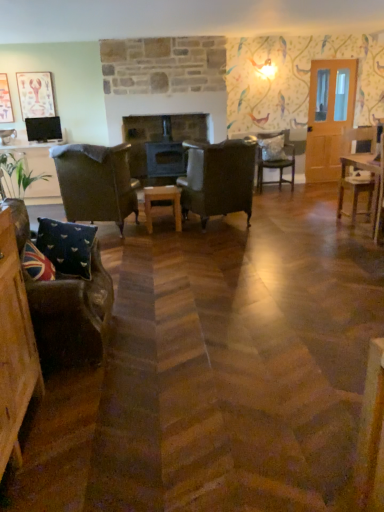
What do you see at coordinates (218, 179) in the screenshot? I see `leather armchair at center, which ranks as the fourth chair in back-to-front order` at bounding box center [218, 179].

Where is `brown leather armchair at left, which appears as the fifth chair when viewed from the right`? This screenshot has width=384, height=512. brown leather armchair at left, which appears as the fifth chair when viewed from the right is located at coordinates (96, 183).

What is the approximate height of white fabric pillow at center, arranged as the 1th pillow when viewed from the back?

The height of white fabric pillow at center, arranged as the 1th pillow when viewed from the back, is 16.36 inches.

The image size is (384, 512). What do you see at coordinates (272, 147) in the screenshot?
I see `white fabric pillow at center, arranged as the 3th pillow when viewed from the left` at bounding box center [272, 147].

The width and height of the screenshot is (384, 512). Describe the element at coordinates (356, 169) in the screenshot. I see `wooden chair at right, which is the second chair from back to front` at that location.

What do you see at coordinates (35, 94) in the screenshot?
I see `matte pink picture frame at upper left, which is counted as the 1th picture frame, starting from the right` at bounding box center [35, 94].

What are the coordinates of `leather armchair at center, which is counted as the 2th chair, starting from the front` in the screenshot? It's located at (218, 179).

Which of these two, white fabric pillow at center, which is counted as the third pillow, starting from the bottom, or wooden picture frame at upper left, which is the first picture frame from left to right, stands taller?

wooden picture frame at upper left, which is the first picture frame from left to right.

From a real-world perspective, is white fabric pillow at center, acting as the third pillow starting from the front, above or below wooden picture frame at upper left, which is the first picture frame from left to right?

In terms of real-world spatial position, white fabric pillow at center, acting as the third pillow starting from the front, is below wooden picture frame at upper left, which is the first picture frame from left to right.

In terms of width, does white fabric pillow at center, acting as the third pillow starting from the front, look wider or thinner when compared to wooden picture frame at upper left, which is the first picture frame from left to right?

Considering their sizes, white fabric pillow at center, acting as the third pillow starting from the front, looks broader than wooden picture frame at upper left, which is the first picture frame from left to right.

From the image's perspective, is union jack fabric pillow at lower left, acting as the first pillow starting from the bottom, above or below leather armchair at center, marked as the 3th chair in a right-to-left arrangement?

union jack fabric pillow at lower left, acting as the first pillow starting from the bottom, is below leather armchair at center, marked as the 3th chair in a right-to-left arrangement.

Measure the distance from union jack fabric pillow at lower left, acting as the first pillow starting from the bottom, to leather armchair at center, marked as the 3th chair in a right-to-left arrangement.

union jack fabric pillow at lower left, acting as the first pillow starting from the bottom, and leather armchair at center, marked as the 3th chair in a right-to-left arrangement, are 8.87 feet apart from each other.

Is union jack fabric pillow at lower left, the third pillow viewed from the right, aimed at leather armchair at center, which is counted as the 2th chair, starting from the front?

No, union jack fabric pillow at lower left, the third pillow viewed from the right, does not turn towards leather armchair at center, which is counted as the 2th chair, starting from the front.

Considering the relative positions of union jack fabric pillow at lower left, the first pillow in the front-to-back sequence, and leather armchair at center, which ranks as the fourth chair in back-to-front order, in the image provided, is union jack fabric pillow at lower left, the first pillow in the front-to-back sequence, to the left of leather armchair at center, which ranks as the fourth chair in back-to-front order, from the viewer's perspective?

Indeed, union jack fabric pillow at lower left, the first pillow in the front-to-back sequence, is positioned on the left side of leather armchair at center, which ranks as the fourth chair in back-to-front order.

Can you confirm if wooden picture frame at upper left, which is the first picture frame from left to right, is shorter than wooden table at center?

No.

Can you confirm if wooden picture frame at upper left, which is the first picture frame from left to right, is thinner than wooden table at center?

Indeed, wooden picture frame at upper left, which is the first picture frame from left to right, has a lesser width compared to wooden table at center.

Is wooden picture frame at upper left, which is the first picture frame from left to right, far away from wooden table at center?

Yes.

From the image's perspective, between wooden picture frame at upper left, which is the first picture frame from left to right, and wooden table at center, which one is located above?

wooden picture frame at upper left, which is the first picture frame from left to right.

Does wooden chair at right, which is the second chair from back to front, contain leather armchair at center, marked as the 3th chair in a right-to-left arrangement?

No, leather armchair at center, marked as the 3th chair in a right-to-left arrangement, is not surrounded by wooden chair at right, which is the second chair from back to front.

Looking at their sizes, would you say wooden chair at right, the 4th chair viewed from the front, is wider or thinner than leather armchair at center, which ranks as the fourth chair in back-to-front order?

Considering their sizes, wooden chair at right, the 4th chair viewed from the front, looks slimmer than leather armchair at center, which ranks as the fourth chair in back-to-front order.

Based on their positions, is wooden chair at right, the 4th chair viewed from the front, located to the left or right of leather armchair at center, marked as the 3th chair in a right-to-left arrangement?

Based on their positions, wooden chair at right, the 4th chair viewed from the front, is located to the right of leather armchair at center, marked as the 3th chair in a right-to-left arrangement.

Can you confirm if wooden chair at right, placed as the 5th chair when sorted from left to right, is positioned to the right of velvet union jack pillow at lower left, marked as the 2th pillow in a bottom-to-top arrangement?

Indeed, wooden chair at right, placed as the 5th chair when sorted from left to right, is positioned on the right side of velvet union jack pillow at lower left, marked as the 2th pillow in a bottom-to-top arrangement.

How far apart are wooden chair at right, the 4th chair viewed from the front, and velvet union jack pillow at lower left, which appears as the 2th pillow when viewed from the right?

wooden chair at right, the 4th chair viewed from the front, and velvet union jack pillow at lower left, which appears as the 2th pillow when viewed from the right, are 3.57 meters apart.

Between wooden chair at right, which is the 1th chair from right to left, and velvet union jack pillow at lower left, marked as the 2th pillow in a bottom-to-top arrangement, which one has larger size?

Bigger between the two is wooden chair at right, which is the 1th chair from right to left.

From the picture: Is the surface of wooden chair at right, which is the second chair from back to front, in direct contact with velvet union jack pillow at lower left, which is the second pillow in top-to-bottom order?

wooden chair at right, which is the second chair from back to front, is not next to velvet union jack pillow at lower left, which is the second pillow in top-to-bottom order, and they're not touching.

Considering the relative sizes of velvet union jack pillow at lower left, marked as the second pillow in a left-to-right arrangement, and velvet dark brown armchair at lower left, which is counted as the 5th chair, starting from the back, in the image provided, is velvet union jack pillow at lower left, marked as the second pillow in a left-to-right arrangement, shorter than velvet dark brown armchair at lower left, which is counted as the 5th chair, starting from the back,?

Yes.

Which object is more forward, velvet union jack pillow at lower left, the 2th pillow viewed from the front, or velvet dark brown armchair at lower left, the fourth chair positioned from the right?

Positioned in front is velvet dark brown armchair at lower left, the fourth chair positioned from the right.

From a real-world perspective, is velvet union jack pillow at lower left, marked as the 2th pillow in a bottom-to-top arrangement, positioned above or below velvet dark brown armchair at lower left, positioned as the first chair in front-to-back order?

In terms of real-world spatial position, velvet union jack pillow at lower left, marked as the 2th pillow in a bottom-to-top arrangement, is above velvet dark brown armchair at lower left, positioned as the first chair in front-to-back order.

Is velvet union jack pillow at lower left, the 2th pillow viewed from the front, wider than velvet dark brown armchair at lower left, the fourth chair positioned from the right?

No, velvet union jack pillow at lower left, the 2th pillow viewed from the front, is not wider than velvet dark brown armchair at lower left, the fourth chair positioned from the right.

Are black wood stove at center and white fabric pillow at center, arranged as the 3th pillow when viewed from the left, making contact?

black wood stove at center and white fabric pillow at center, arranged as the 3th pillow when viewed from the left, are clearly separated.

What's the angular difference between black wood stove at center and white fabric pillow at center, which is counted as the third pillow, starting from the bottom,'s facing directions?

0.00127 degrees separate the facing orientations of black wood stove at center and white fabric pillow at center, which is counted as the third pillow, starting from the bottom.

Looking at this image, from the image's perspective, which is below, black wood stove at center or white fabric pillow at center, acting as the third pillow starting from the front?

→ black wood stove at center is shown below in the image.

From the wooden picture frame at upper left, which is the first picture frame from left to right, count 3rd pillow to the right and point to it. Please provide its 2D coordinates.

[(272, 147)]

Which chair is the 1st one when counting from the back of the union jack fabric pillow at lower left, acting as the third pillow starting from the top? Please provide its 2D coordinates.

[(218, 179)]

From the image, which object appears to be nearer to brown leather armchair at left, which appears as the fifth chair when viewed from the right, wooden picture frame at upper left, the second picture frame from the right, or white fabric pillow at center, acting as the third pillow starting from the front?

Among the two, wooden picture frame at upper left, the second picture frame from the right, is located nearer to brown leather armchair at left, which appears as the fifth chair when viewed from the right.

Based on their spatial positions, is white fabric pillow at center, arranged as the first pillow when viewed from the top, or velvet union jack pillow at lower left, which appears as the 2th pillow when viewed from the right, closer to matte pink picture frame at upper left, which is counted as the 1th picture frame, starting from the right?

Based on the image, white fabric pillow at center, arranged as the first pillow when viewed from the top, appears to be nearer to matte pink picture frame at upper left, which is counted as the 1th picture frame, starting from the right.

Looking at the image, which one is located further to wooden chair at right, which is the second chair from back to front, velvet cushioned chair at center, which is the 1th chair in back-to-front order, or wooden table at center?

wooden table at center is further to wooden chair at right, which is the second chair from back to front.

Considering their positions, is union jack fabric pillow at lower left, marked as the 3th pillow in a back-to-front arrangement, positioned closer to wooden table at center than wooden chair at right, the 4th chair viewed from the front?

Based on the image, wooden chair at right, the 4th chair viewed from the front, appears to be nearer to wooden table at center.

From the picture: Based on their spatial positions, is matte pink picture frame at upper left, which is counted as the 1th picture frame, starting from the right, or wooden picture frame at upper left, the second picture frame from the right, closer to velvet union jack pillow at lower left, marked as the 2th pillow in a bottom-to-top arrangement?

Among the two, matte pink picture frame at upper left, which is counted as the 1th picture frame, starting from the right, is located nearer to velvet union jack pillow at lower left, marked as the 2th pillow in a bottom-to-top arrangement.

Based on their spatial positions, is black wood stove at center or wooden chair at right, the 4th chair viewed from the front, closer to wooden picture frame at upper left, which is the first picture frame from left to right?

black wood stove at center is closer to wooden picture frame at upper left, which is the first picture frame from left to right.

Considering their positions, is matte pink picture frame at upper left, which is counted as the 1th picture frame, starting from the right, positioned closer to velvet union jack pillow at lower left, which is the second pillow in top-to-bottom order, than brown leather armchair at left, arranged as the 3th chair when viewed from the back?

The object closer to velvet union jack pillow at lower left, which is the second pillow in top-to-bottom order, is brown leather armchair at left, arranged as the 3th chair when viewed from the back.

Based on their spatial positions, is white fabric pillow at center, which is counted as the third pillow, starting from the bottom, or union jack fabric pillow at lower left, marked as the 3th pillow in a back-to-front arrangement, closer to matte pink picture frame at upper left, placed as the 2th picture frame when sorted from left to right?

Among the two, white fabric pillow at center, which is counted as the third pillow, starting from the bottom, is located nearer to matte pink picture frame at upper left, placed as the 2th picture frame when sorted from left to right.

Where is `table between brown leather armchair at left, which appears as the fifth chair when viewed from the right, and matte pink picture frame at upper left, placed as the 2th picture frame when sorted from left to right, in the front-back direction`? This screenshot has width=384, height=512. table between brown leather armchair at left, which appears as the fifth chair when viewed from the right, and matte pink picture frame at upper left, placed as the 2th picture frame when sorted from left to right, in the front-back direction is located at coordinates (162, 200).

Locate an element on the screen. fireplace between velvet union jack pillow at lower left, marked as the second pillow in a left-to-right arrangement, and white fabric pillow at center, arranged as the 1th pillow when viewed from the back, from front to back is located at coordinates (161, 145).

The height and width of the screenshot is (512, 384). In order to click on fireplace located between wooden picture frame at upper left, which is the first picture frame from left to right, and wooden table at center in the left-right direction in this screenshot , I will do `click(161, 145)`.

The width and height of the screenshot is (384, 512). What are the coordinates of `table between velvet union jack pillow at lower left, marked as the second pillow in a left-to-right arrangement, and white fabric pillow at center, which is counted as the third pillow, starting from the bottom, along the z-axis` in the screenshot? It's located at (162, 200).